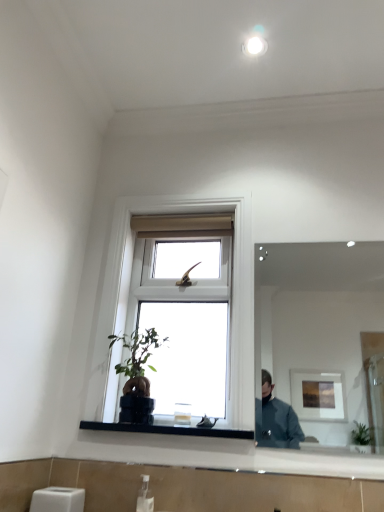
Question: From the image's perspective, is clear glass mirror at upper right over white plastic soap dispenser at lower center?

Choices:
 (A) no
 (B) yes

Answer: (B)

Question: From a real-world perspective, is clear glass mirror at upper right on top of white plastic soap dispenser at lower center?

Choices:
 (A) no
 (B) yes

Answer: (B)

Question: Does clear glass mirror at upper right appear on the right side of white plastic soap dispenser at lower center?

Choices:
 (A) no
 (B) yes

Answer: (B)

Question: Is clear glass mirror at upper right next to white plastic soap dispenser at lower center?

Choices:
 (A) no
 (B) yes

Answer: (A)

Question: Is white plastic soap dispenser at lower center a part of clear glass mirror at upper right?

Choices:
 (A) no
 (B) yes

Answer: (A)

Question: Is clear glass mirror at upper right oriented away from white plastic soap dispenser at lower center?

Choices:
 (A) yes
 (B) no

Answer: (B)

Question: Is white wood window at center completely or partially inside white plastic soap dispenser at lower center?

Choices:
 (A) no
 (B) yes

Answer: (A)

Question: Is white plastic soap dispenser at lower center thinner than white wood window at center?

Choices:
 (A) no
 (B) yes

Answer: (B)

Question: Considering the relative positions of white plastic soap dispenser at lower center and white wood window at center in the image provided, is white plastic soap dispenser at lower center to the left of white wood window at center from the viewer's perspective?

Choices:
 (A) no
 (B) yes

Answer: (B)

Question: Can you confirm if white plastic soap dispenser at lower center is shorter than white wood window at center?

Choices:
 (A) yes
 (B) no

Answer: (A)

Question: Would you say white plastic soap dispenser at lower center is outside white wood window at center?

Choices:
 (A) no
 (B) yes

Answer: (B)

Question: Is white plastic soap dispenser at lower center positioned before white wood window at center?

Choices:
 (A) yes
 (B) no

Answer: (A)

Question: From a real-world perspective, is clear glass mirror at upper right positioned under white wood window at center based on gravity?

Choices:
 (A) no
 (B) yes

Answer: (B)